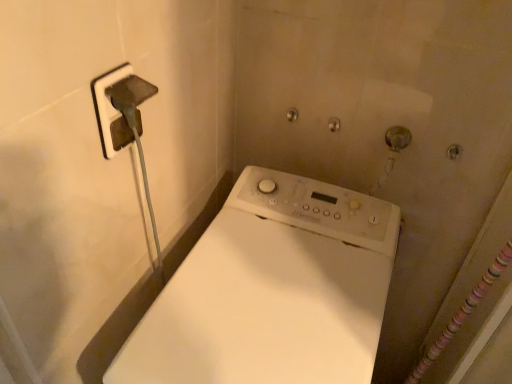
The width and height of the screenshot is (512, 384). What do you see at coordinates (272, 291) in the screenshot?
I see `white plastic washing machine at center` at bounding box center [272, 291].

This screenshot has height=384, width=512. What are the coordinates of `white plastic washing machine at center` in the screenshot? It's located at (272, 291).

What is the approximate width of white plastic washing machine at center?

It is 60.81 centimeters.

You are a GUI agent. You are given a task and a screenshot of the screen. Output one action in this format:
    pyautogui.click(x=<x>, y=<y>)
    Task: Click on the white plastic washing machine at center
    
    Given the screenshot: What is the action you would take?
    pyautogui.click(x=272, y=291)